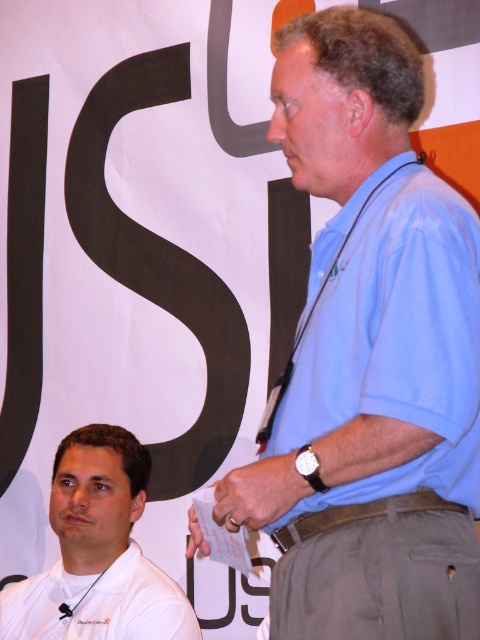
Can you confirm if light blue cotton polo shirt at center is positioned to the left of white matte dress shirt at lower left?

Incorrect, light blue cotton polo shirt at center is not on the left side of white matte dress shirt at lower left.

Does light blue cotton polo shirt at center appear on the right side of white matte dress shirt at lower left?

Yes, light blue cotton polo shirt at center is to the right of white matte dress shirt at lower left.

Who is more distant from viewer, (363, 344) or (132, 568)?

The point (132, 568) is behind.

Locate an element on the screen. This screenshot has height=640, width=480. light blue cotton polo shirt at center is located at coordinates (396, 342).

Who is higher up, light blue cotton polo shirt at center or white matte shirt at lower left?

light blue cotton polo shirt at center

How far apart are light blue cotton polo shirt at center and white matte shirt at lower left?

The distance of light blue cotton polo shirt at center from white matte shirt at lower left is 1.02 meters.

Identify the location of light blue cotton polo shirt at center. The height and width of the screenshot is (640, 480). (396, 342).

Between white matte shirt at lower left and white matte dress shirt at lower left, which one appears on the right side from the viewer's perspective?

From the viewer's perspective, white matte dress shirt at lower left appears more on the right side.

Measure the distance between white matte shirt at lower left and white matte dress shirt at lower left.

The distance of white matte shirt at lower left from white matte dress shirt at lower left is 1.48 inches.

Describe the element at coordinates (97, 552) in the screenshot. I see `white matte shirt at lower left` at that location.

Find the location of `white matte shirt at lower left`. white matte shirt at lower left is located at coordinates (97, 552).